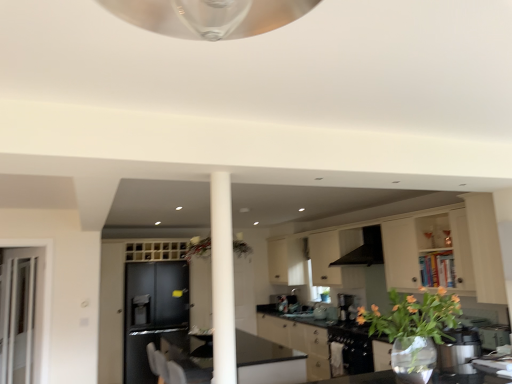
Question: In terms of height, does matte black cabinet at left, which ranks as the first cabinetry in left-to-right order, look taller or shorter compared to matte white cabinets at center, positioned as the 3th cabinetry in left-to-right order?

Choices:
 (A) short
 (B) tall

Answer: (B)

Question: Is matte black cabinet at left, which ranks as the first cabinetry in left-to-right order, in front of or behind matte white cabinets at center, acting as the 1th cabinetry starting from the right, in the image?

Choices:
 (A) behind
 (B) front

Answer: (A)

Question: Which of these objects is positioned farthest from the clear glass door at left?

Choices:
 (A) satin black coffee machine at center
 (B) matte black cabinet at left, positioned as the third cabinetry in right-to-left order
 (C) transparent glass table at lower right
 (D) translucent glass vase at lower right
 (E) black glossy countertop at center

Answer: (D)

Question: Which of these objects is positioned farthest from the clear glass door at left?

Choices:
 (A) translucent glass vase at lower right
 (B) matte white cabinets at center, acting as the 1th cabinetry starting from the right
 (C) matte beige cabinets at center, which is counted as the second cabinetry, starting from the right
 (D) black matte exhaust hood at center
 (E) matte black cabinet at left, which ranks as the first cabinetry in left-to-right order

Answer: (B)